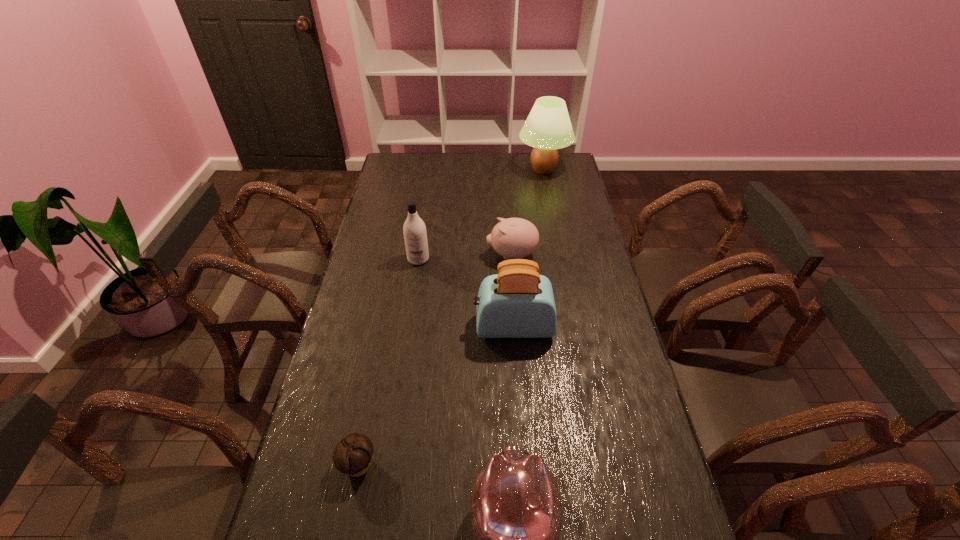
The height and width of the screenshot is (540, 960). In order to click on object present at the right edge in this screenshot , I will do `click(548, 127)`.

This screenshot has width=960, height=540. What are the coordinates of `object that is at the far right corner` in the screenshot? It's located at (548, 127).

In the image, there is a desktop. At what (x,y) coordinates should I click in order to perform the action: click on vacant space at the far edge. Please return your answer as a coordinate pair (x, y). The height and width of the screenshot is (540, 960). Looking at the image, I should click on (425, 154).

At what (x,y) coordinates should I click in order to perform the action: click on free space at the left edge of the desktop. Please return your answer as a coordinate pair (x, y). Looking at the image, I should click on (373, 370).

Identify the location of vacant space at the right edge of the desktop. This screenshot has height=540, width=960. (636, 493).

Identify the location of free spot at the far left corner of the desktop. (397, 172).

Locate an element on the screen. The image size is (960, 540). free spot between the fifth tallest object and the muffin is located at coordinates (435, 360).

Identify the location of vacant area that lies between the shampoo and the farthest object. (481, 214).

Identify the location of vacant space that's between the fifth tallest object and the shortest object. Image resolution: width=960 pixels, height=540 pixels. (435, 360).

The height and width of the screenshot is (540, 960). In order to click on unoccupied position between the shampoo and the shortest object in this screenshot , I will do [388, 362].